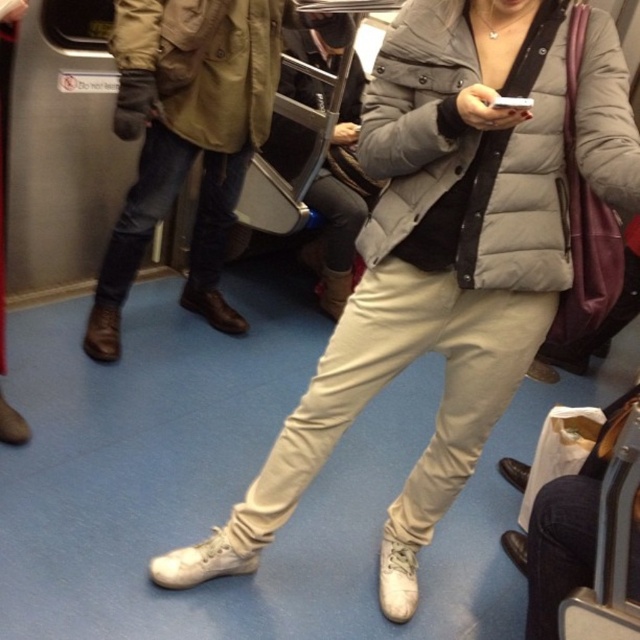
Question: Is white leather sneakers at lower center closer to camera compared to leather boots at lower left?

Choices:
 (A) yes
 (B) no

Answer: (A)

Question: From the image, what is the correct spatial relationship of white leather sneakers at lower center in relation to leather boots at lower left?

Choices:
 (A) above
 (B) below

Answer: (B)

Question: Which point is farther to the camera?

Choices:
 (A) white leather sneakers at lower center
 (B) leather boots at lower left

Answer: (B)

Question: Which point is closer to the camera taking this photo?

Choices:
 (A) (342, 316)
 (B) (198, 72)

Answer: (A)

Question: Which point is farther to the camera?

Choices:
 (A) white leather sneakers at lower center
 (B) leather boots at lower left

Answer: (B)

Question: Considering the relative positions of white leather sneakers at lower center and leather boots at lower left in the image provided, where is white leather sneakers at lower center located with respect to leather boots at lower left?

Choices:
 (A) right
 (B) left

Answer: (A)